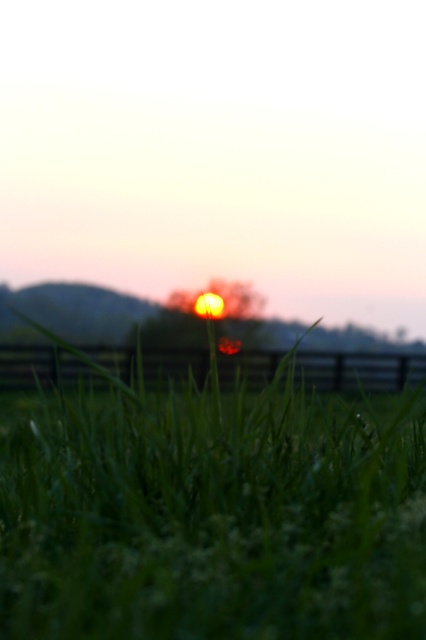
Between green grassy at center and black wooden fence at lower center, which one appears on the left side from the viewer's perspective?

Positioned to the left is black wooden fence at lower center.

Can you confirm if green grassy at center is positioned to the left of black wooden fence at lower center?

No, green grassy at center is not to the left of black wooden fence at lower center.

What do you see at coordinates (212, 513) in the screenshot? I see `green grassy at center` at bounding box center [212, 513].

This screenshot has width=426, height=640. Find the location of `green grassy at center`. green grassy at center is located at coordinates (212, 513).